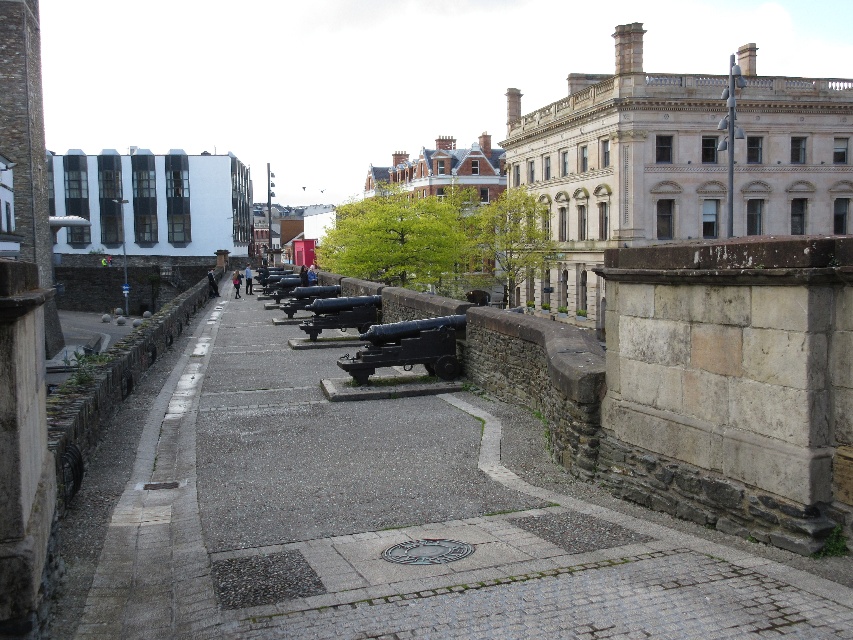
Question: Among these points, which one is nearest to the camera?

Choices:
 (A) (323, 300)
 (B) (393, 339)

Answer: (B)

Question: Which object is positioned closest to the polished bronze cannon at center?

Choices:
 (A) stone paved path at center
 (B) black matte cannon at center

Answer: (B)

Question: Observing the image, what is the correct spatial positioning of stone paved path at center in reference to black matte cannon at center?

Choices:
 (A) left
 (B) right

Answer: (A)

Question: Does black matte cannon at center appear on the left side of polished bronze cannon at center?

Choices:
 (A) no
 (B) yes

Answer: (A)

Question: Among these points, which one is farthest from the camera?

Choices:
 (A) (398, 353)
 (B) (323, 314)
 (C) (90, 609)

Answer: (B)

Question: Is stone paved path at center thinner than black matte cannon at center?

Choices:
 (A) no
 (B) yes

Answer: (A)